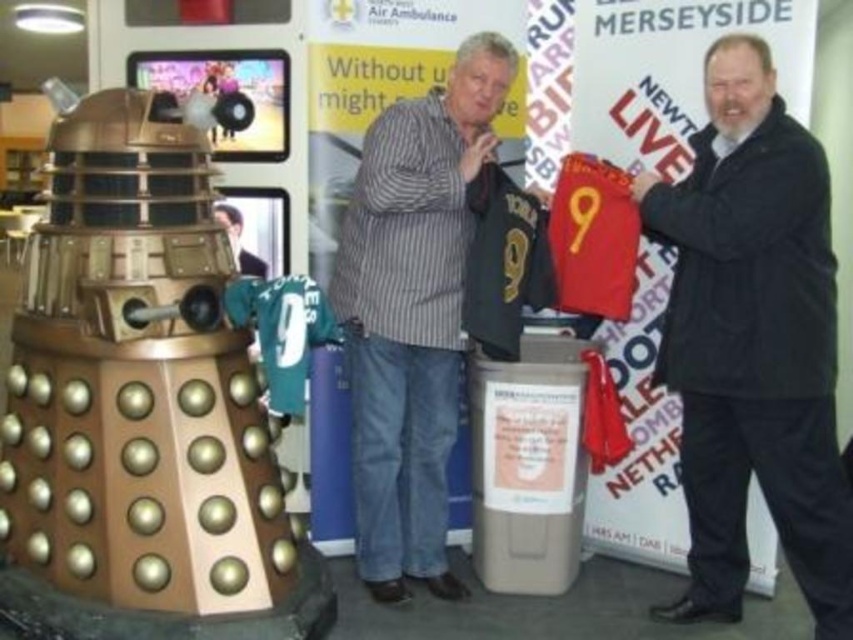
Question: Is striped cotton shirt at center to the right of smooth black shirt at center from the viewer's perspective?

Choices:
 (A) yes
 (B) no

Answer: (A)

Question: Which object appears closest to the camera in this image?

Choices:
 (A) dark gray jacket at center
 (B) striped cotton shirt at center

Answer: (A)

Question: Is dark gray jacket at center wider than striped cotton shirt at center?

Choices:
 (A) yes
 (B) no

Answer: (B)

Question: Estimate the real-world distances between objects in this image. Which object is farther from the smooth black shirt at center?

Choices:
 (A) dark gray jacket at center
 (B) striped cotton shirt at center

Answer: (A)

Question: Which point is closer to the camera?

Choices:
 (A) dark gray jacket at center
 (B) striped cotton shirt at center

Answer: (A)

Question: Can you confirm if striped cotton shirt at center is wider than smooth black shirt at center?

Choices:
 (A) yes
 (B) no

Answer: (A)